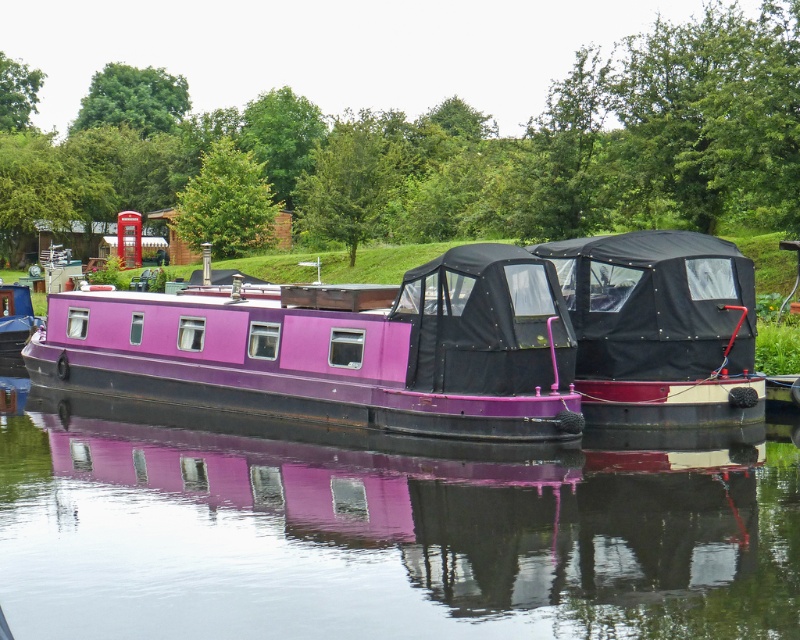
Can you confirm if purple glossy boat at center is bigger than black matte boat at center?

Indeed, purple glossy boat at center has a larger size compared to black matte boat at center.

Is point (41, 449) positioned after point (666, 417)?

No, (41, 449) is in front of (666, 417).

This screenshot has height=640, width=800. Identify the location of purple glossy boat at center. [x=384, y=536].

Locate an element on the screen. purple glossy boat at center is located at coordinates (384, 536).

Consider the image. Can you confirm if purple glossy barge at center is shorter than black matte boat at center?

Yes.

Can you confirm if purple glossy barge at center is smaller than black matte boat at center?

No.

The height and width of the screenshot is (640, 800). What do you see at coordinates (337, 348) in the screenshot?
I see `purple glossy barge at center` at bounding box center [337, 348].

Identify the location of purple glossy barge at center. 337,348.

Does purple glossy boat at center have a smaller size compared to purple glossy barge at center?

Correct, purple glossy boat at center occupies less space than purple glossy barge at center.

I want to click on purple glossy boat at center, so 384,536.

Measure the distance between point [308,486] and camera.

Point [308,486] and camera are 53.83 feet apart.

Where is `purple glossy boat at center`? The width and height of the screenshot is (800, 640). purple glossy boat at center is located at coordinates pyautogui.click(x=384, y=536).